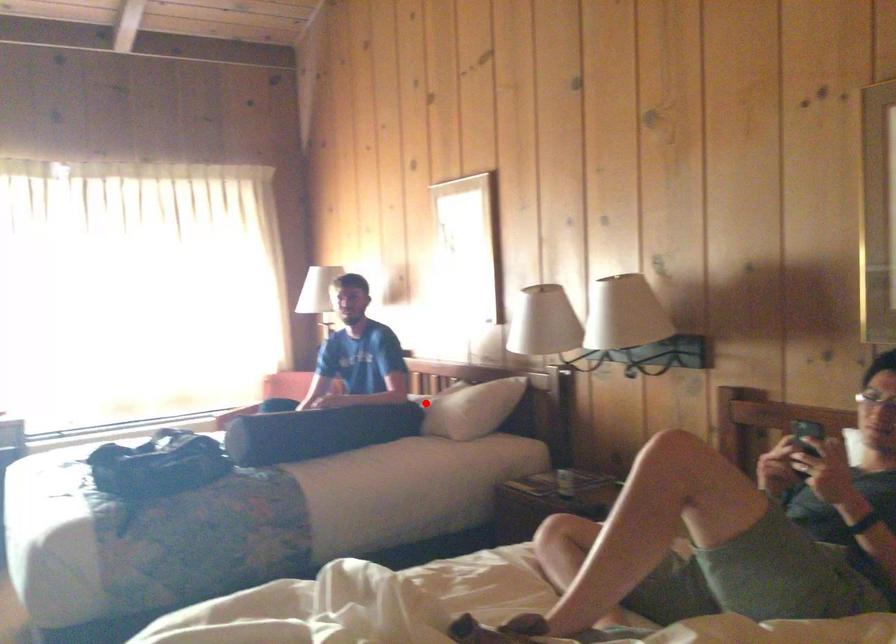
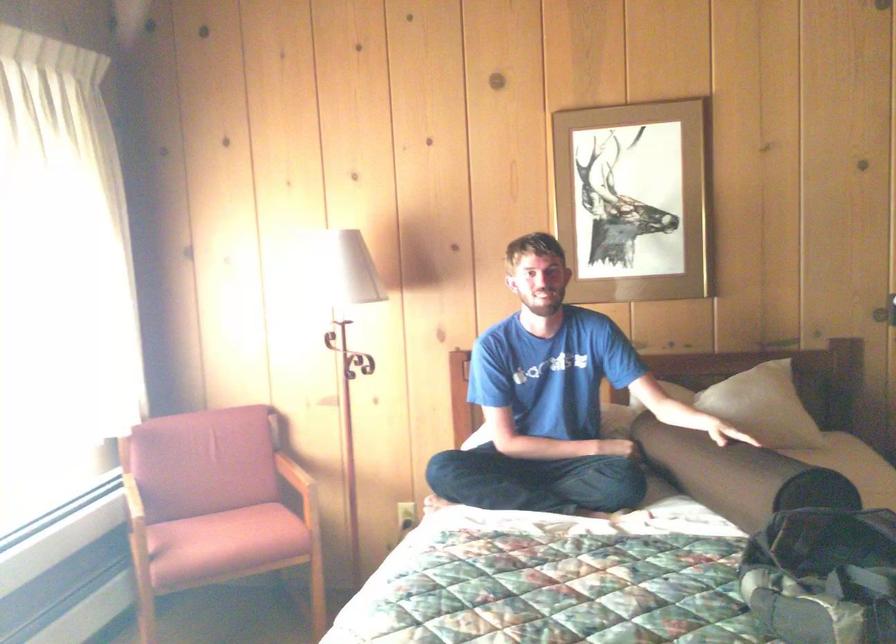
In the second image, find the point that corresponds to the highlighted location in the first image.

(762, 406)